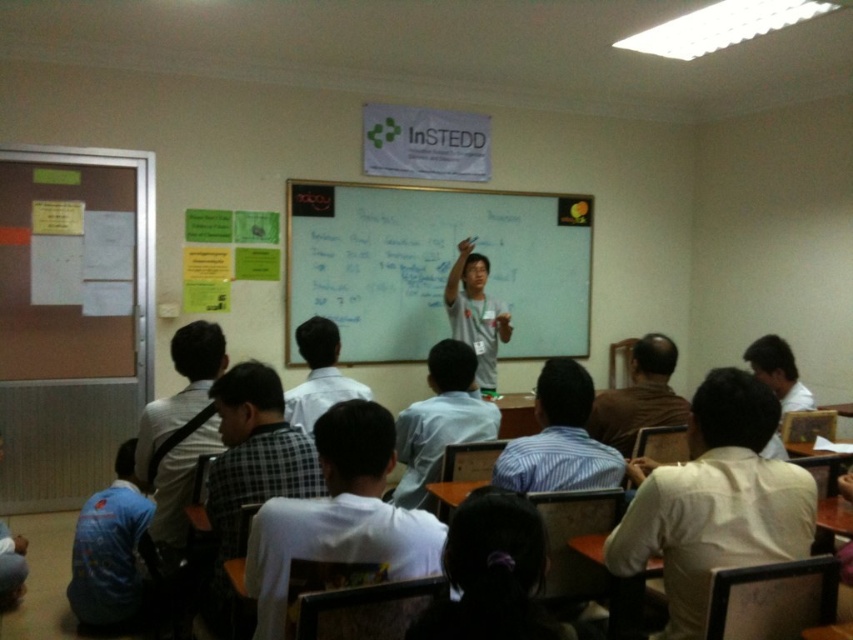
Based on the scene description, where is the white shirt at center located in terms of coordinates?

The white shirt at center is located at point coordinates of [715,500].

You are a photographer standing at the back of the classroom. You want to take a photo that includes both the point at (445, 257) and the point at (747, 528). Which point is closer to your camera?

The point at (445, 257) is closer to the camera than the point at (747, 528).